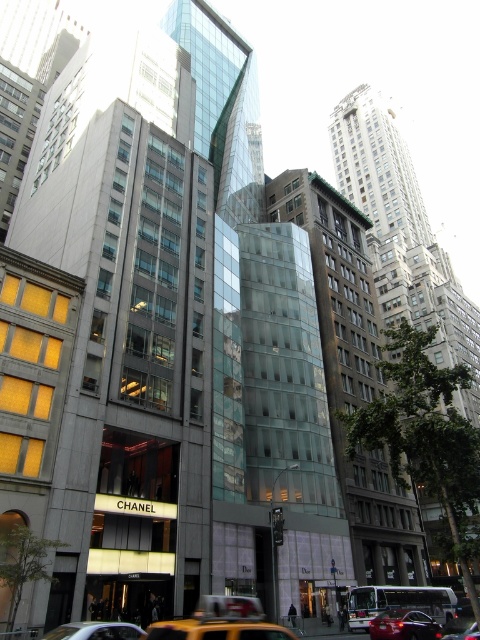
Question: Which point is farther to the camera?

Choices:
 (A) yellow matte taxi cab at center
 (B) metallic yellow taxi cab at center

Answer: (B)

Question: Can you confirm if shiny black sedan at center is positioned below metallic yellow taxi cab at center?

Choices:
 (A) no
 (B) yes

Answer: (A)

Question: Can you confirm if shiny black sedan at center is wider than yellow matte taxi cab at center?

Choices:
 (A) yes
 (B) no

Answer: (B)

Question: Does yellow rubber taxi at lower center appear under yellow matte taxi cab at center?

Choices:
 (A) no
 (B) yes

Answer: (A)

Question: Which of the following is the closest to the observer?

Choices:
 (A) yellow matte taxi cab at center
 (B) metallic yellow taxi cab at center
 (C) shiny black sedan at center

Answer: (A)

Question: Which point is closer to the camera?

Choices:
 (A) (103, 632)
 (B) (456, 632)
 (C) (274, 630)

Answer: (C)